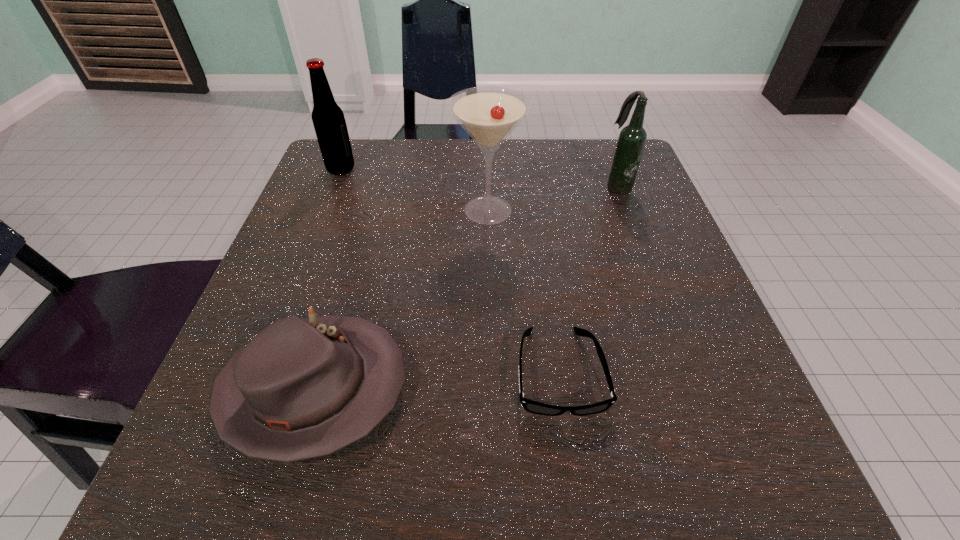
Find the location of a particular element. The width and height of the screenshot is (960, 540). the farthest object is located at coordinates (328, 119).

Locate an element on the screen. This screenshot has width=960, height=540. the farther beer bottle is located at coordinates (328, 119).

Find the location of a particular element. martini is located at coordinates (489, 114).

This screenshot has height=540, width=960. I want to click on the rightmost object, so click(631, 141).

Where is `the right beer bottle`? The image size is (960, 540). the right beer bottle is located at coordinates (631, 141).

Locate an element on the screen. The width and height of the screenshot is (960, 540). hat is located at coordinates (306, 388).

Locate an element on the screen. This screenshot has height=540, width=960. the shortest object is located at coordinates (530, 406).

Image resolution: width=960 pixels, height=540 pixels. Identify the location of vacant point located 0.210m on the front of the left beer bottle. (313, 240).

In order to click on vacant space located on the right of the martini in this screenshot , I will do `click(637, 210)`.

The width and height of the screenshot is (960, 540). What are the coordinates of `free space located 0.070m on the left of the nearer beer bottle` in the screenshot? It's located at pos(572,187).